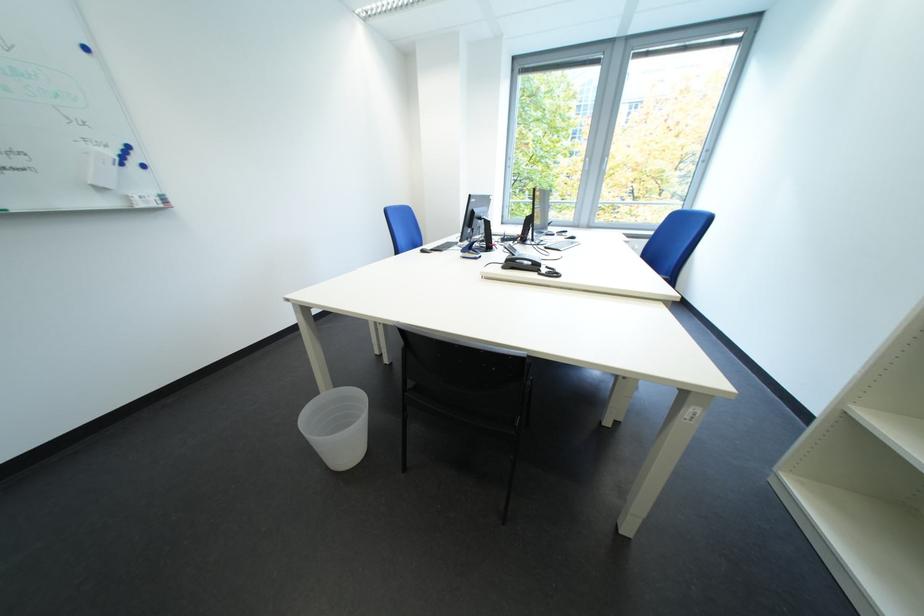
Find the location of `black telephone handset`. black telephone handset is located at coordinates (520, 260).